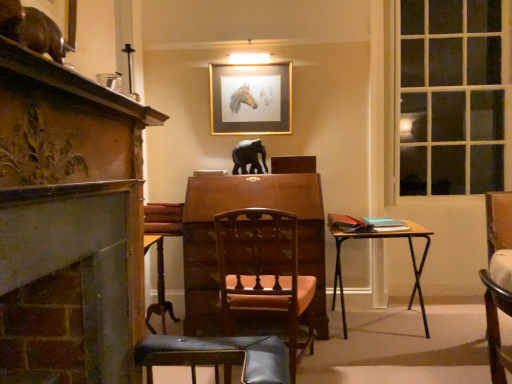
Image resolution: width=512 pixels, height=384 pixels. In order to click on vacant space in front of wooden table at right in this screenshot , I will do `click(393, 363)`.